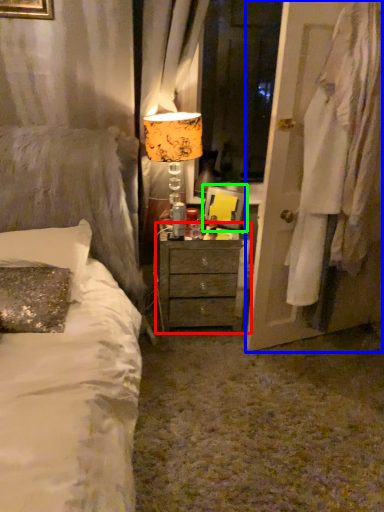
Question: Which is nearer to the nightstand (highlighted by a red box)? door (highlighted by a blue box) or picture frame (highlighted by a green box).

Choices:
 (A) door
 (B) picture frame

Answer: (B)